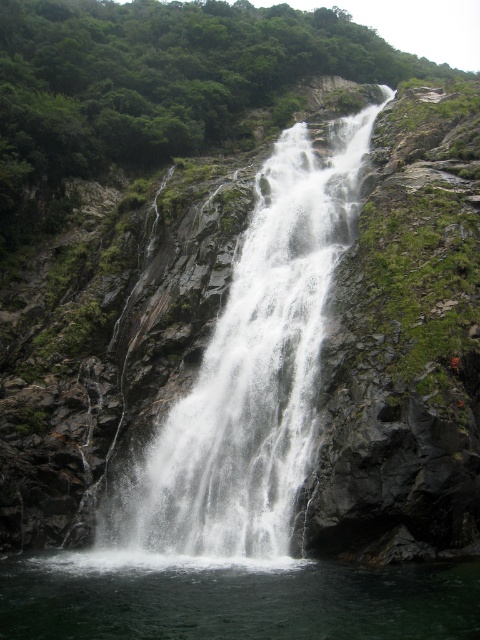
Is white frothy water at center above clear water at center?

Yes.

Locate an element on the screen. This screenshot has width=480, height=640. white frothy water at center is located at coordinates (250, 372).

Find the location of a particular element. The width and height of the screenshot is (480, 640). white frothy water at center is located at coordinates pos(250,372).